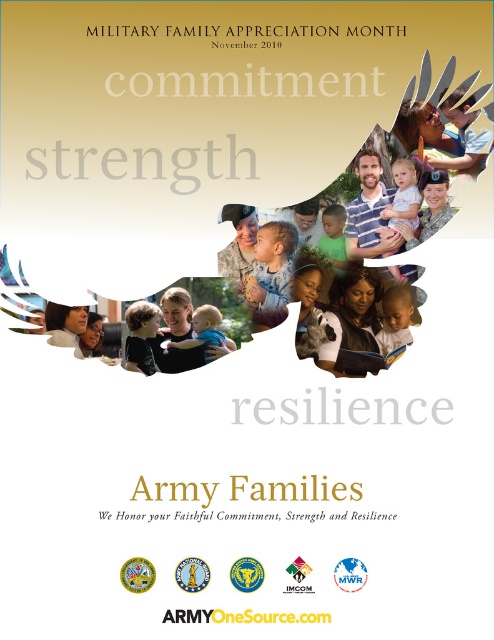
From the picture: In the promotional poster for Military Family Appreciation Month, there is a smooth skin child at center and a soft beige baby at center. Which of these two is bigger in size?

The smooth skin child at center is larger in size compared to the soft beige baby at center.

Consider the image. Based on the scene description, where exactly is the smooth skin child at center located in the image?

The smooth skin child at center is located at the 2D coordinates point (271, 269) in the image.

You are an art curator examining this poster. You notice two central figures, the smooth skin child at center and the soft beige baby at center. Which one appears higher up in the composition?

The smooth skin child at center is located above the soft beige baby at center, so it appears higher up in the composition.